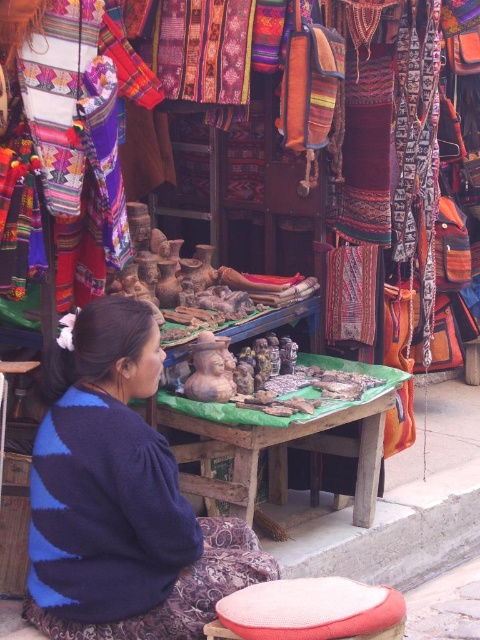
Looking at this image, is blue striped sweater at center below red woven stool at lower center?

Actually, blue striped sweater at center is above red woven stool at lower center.

Does blue striped sweater at center have a smaller size compared to red woven stool at lower center?

Actually, blue striped sweater at center might be larger than red woven stool at lower center.

At what (x,y) coordinates should I click in order to perform the action: click on blue striped sweater at center. Please return your answer as a coordinate pair (x, y). This screenshot has width=480, height=640. Looking at the image, I should click on (120, 499).

The height and width of the screenshot is (640, 480). In order to click on blue striped sweater at center in this screenshot , I will do [120, 499].